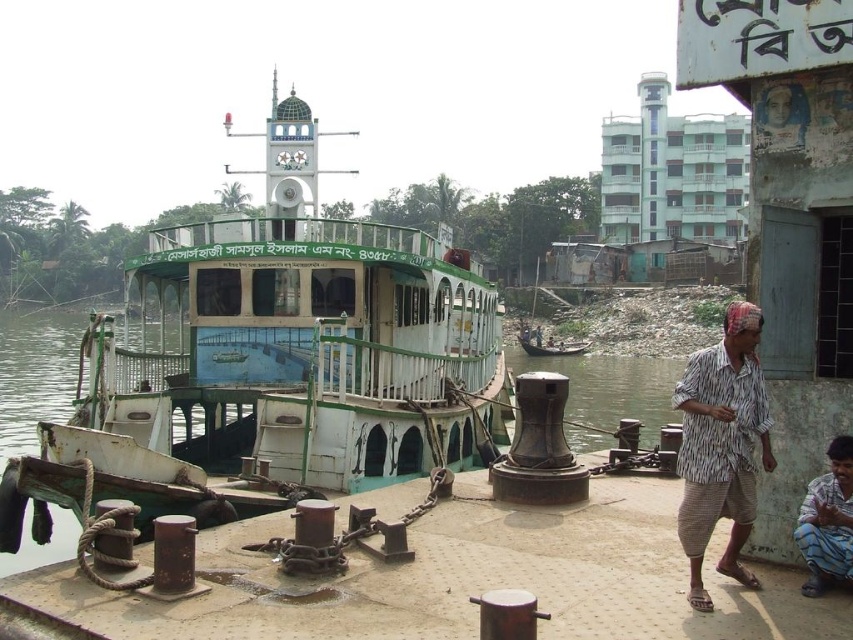
You are a crane operator tasked with loading a container onto the green painted wood boat at center. The container is 30 meters long. Can you safely load it without overhanging the edge of the boat?

The container is 30 meters long, and the boat is 29.99 meters long. Since the container is slightly longer, it will overhang the edge of the boat by approximately 0.01 meters. Therefore, it is not safe to load the container onto the green painted wood boat at center without overhanging.

You are standing on the riverside pier and notice a striped fabric shirt at lower right and a wooden boat at center. Which object is nearer to you?

The striped fabric shirt at lower right is closer to you than the wooden boat at center.

You are standing on the pier and want to board the ferry. The green painted wood boat at center is your destination. There is a person wearing a striped fabric shirt at lower right blocking your path. Can you walk around them to reach the boat?

The green painted wood boat at center is above striped fabric shirt at lower right, meaning the boat is elevated relative to the person. You can walk around the person since they are on the same level as the pier while the boat is higher up.